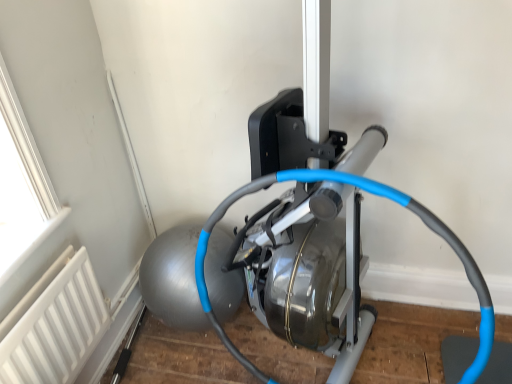
Question: Does point (103, 324) appear closer or farther from the camera than point (456, 240)?

Choices:
 (A) farther
 (B) closer

Answer: (A)

Question: Is white matte radiator at lower left spatially inside blue rubber hose at center, or outside of it?

Choices:
 (A) outside
 (B) inside

Answer: (A)

Question: From the image's perspective, is white matte radiator at lower left located above or below blue rubber hose at center?

Choices:
 (A) below
 (B) above

Answer: (A)

Question: From a real-world perspective, relative to white matte radiator at lower left, is blue rubber hose at center vertically above or below?

Choices:
 (A) above
 (B) below

Answer: (A)

Question: Is blue rubber hose at center wider or thinner than white matte radiator at lower left?

Choices:
 (A) thin
 (B) wide

Answer: (B)

Question: From the image's perspective, is blue rubber hose at center above or below white matte radiator at lower left?

Choices:
 (A) above
 (B) below

Answer: (A)

Question: Would you say blue rubber hose at center is inside or outside white matte radiator at lower left?

Choices:
 (A) outside
 (B) inside

Answer: (A)